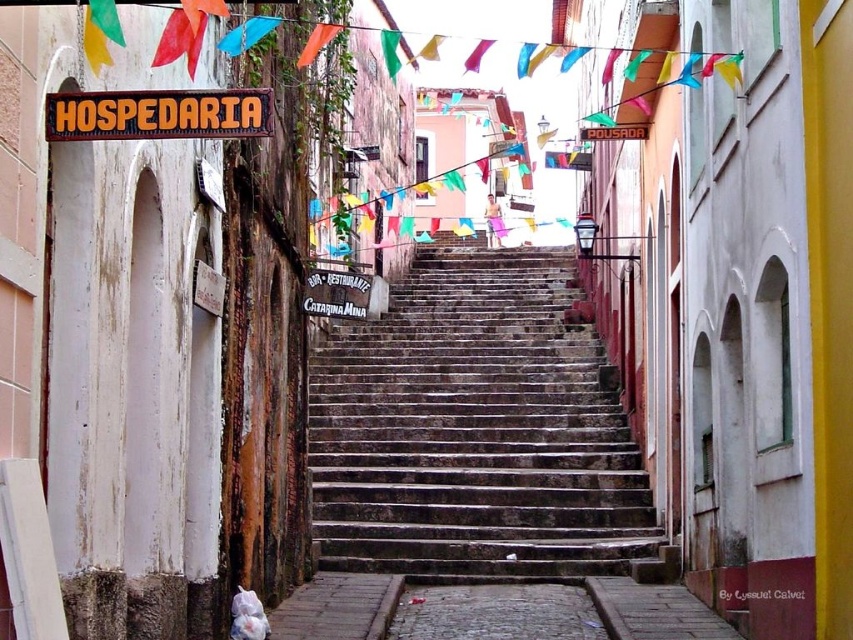
Question: Observing the image, what is the correct spatial positioning of stone steps at center in reference to orange fabric flag at upper center?

Choices:
 (A) left
 (B) right

Answer: (B)

Question: Does orange wood sign at upper center appear over orange fabric flag at upper center?

Choices:
 (A) no
 (B) yes

Answer: (A)

Question: Which point is closer to the camera?

Choices:
 (A) matte red sign at center
 (B) orange fabric flag at upper center
 (C) orange wood sign at upper center

Answer: (C)

Question: Which is farther from the matte red sign at center?

Choices:
 (A) orange wood sign at upper center
 (B) orange fabric flag at upper center

Answer: (A)

Question: Which object is farther from the camera taking this photo?

Choices:
 (A) stone steps at center
 (B) orange fabric flag at upper center
 (C) matte red sign at center

Answer: (C)

Question: Can you confirm if stone steps at center is bigger than matte red sign at center?

Choices:
 (A) yes
 (B) no

Answer: (A)